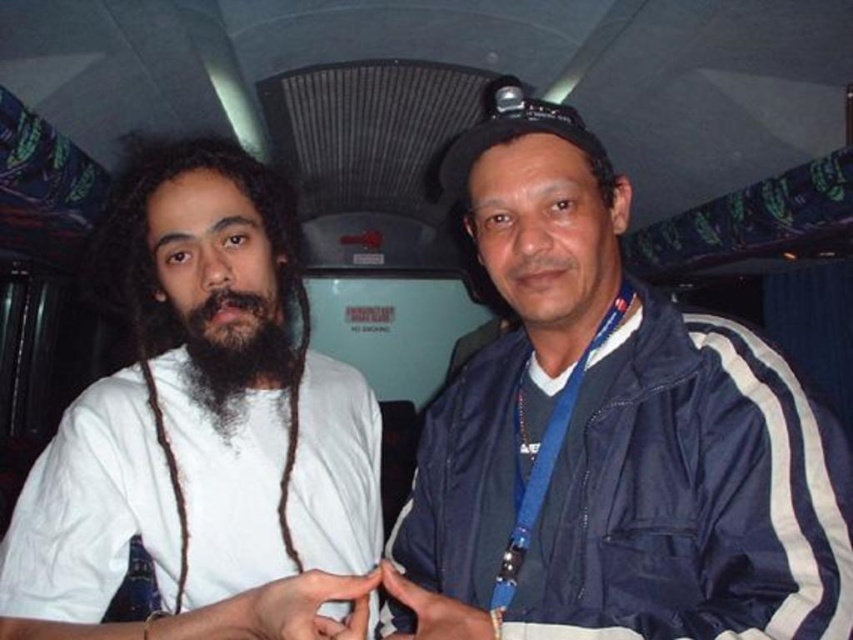
Question: Considering the relative positions of white matte shirt at left and black fuzzy beard at center in the image provided, where is white matte shirt at left located with respect to black fuzzy beard at center?

Choices:
 (A) below
 (B) above

Answer: (A)

Question: Which of these objects is positioned farthest from the white matte shirt at left?

Choices:
 (A) blue fabric jacket at right
 (B) black fuzzy beard at center

Answer: (A)

Question: Which object appears closest to the camera in this image?

Choices:
 (A) blue fabric jacket at right
 (B) black fuzzy beard at center

Answer: (A)

Question: Can you confirm if blue fabric jacket at right is positioned below black fuzzy beard at center?

Choices:
 (A) yes
 (B) no

Answer: (B)

Question: Among these points, which one is farthest from the camera?

Choices:
 (A) (450, 595)
 (B) (305, 323)
 (C) (96, 416)

Answer: (B)

Question: Is the position of blue fabric jacket at right less distant than that of black fuzzy beard at center?

Choices:
 (A) yes
 (B) no

Answer: (A)